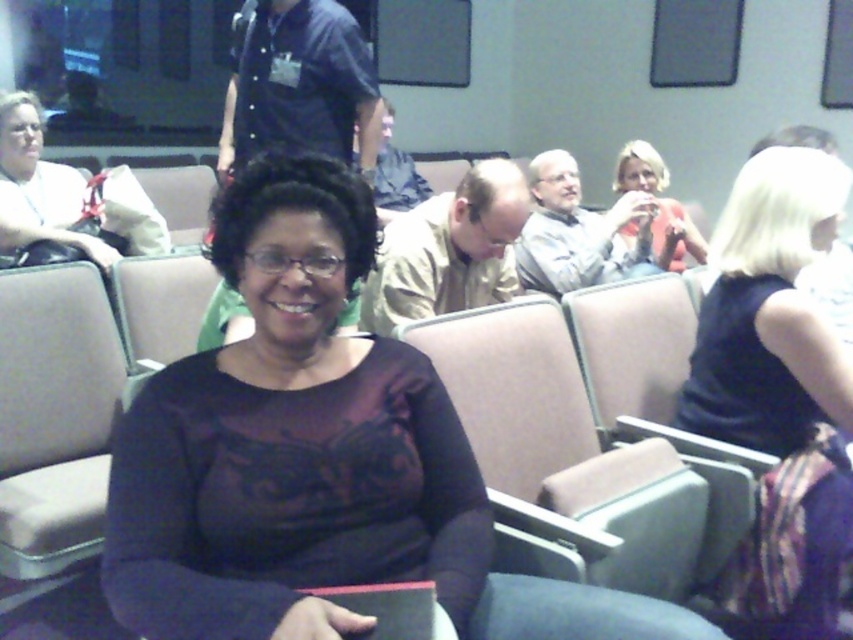
Question: Is black fabric dress at right to the left of matte white shirt at left from the viewer's perspective?

Choices:
 (A) no
 (B) yes

Answer: (A)

Question: Which of the following is the closest to the observer?

Choices:
 (A) (729, 426)
 (B) (15, 161)

Answer: (A)

Question: Estimate the real-world distances between objects in this image. Which object is farther from the dark purple satin blouse at center?

Choices:
 (A) matte white shirt at left
 (B) black fabric dress at right
 (C) matte pink phone at upper right

Answer: (C)

Question: Which point is closer to the camera?

Choices:
 (A) (662, 250)
 (B) (334, 368)

Answer: (B)

Question: Can you confirm if black fabric dress at right is thinner than matte white shirt at left?

Choices:
 (A) yes
 (B) no

Answer: (A)

Question: Can you confirm if dark purple satin blouse at center is positioned below black fabric dress at right?

Choices:
 (A) yes
 (B) no

Answer: (B)